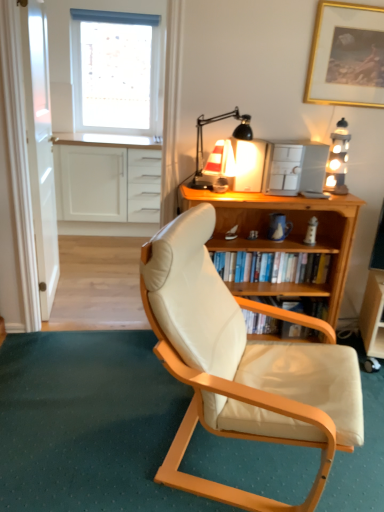
Question: Is white matte window at upper left aimed at transparent glass door at left?

Choices:
 (A) no
 (B) yes

Answer: (B)

Question: Is white matte window at upper left shorter than transparent glass door at left?

Choices:
 (A) no
 (B) yes

Answer: (B)

Question: Is the depth of white matte window at upper left less than that of transparent glass door at left?

Choices:
 (A) yes
 (B) no

Answer: (B)

Question: Is white matte window at upper left located outside transparent glass door at left?

Choices:
 (A) no
 (B) yes

Answer: (B)

Question: Is white matte window at upper left to the right of transparent glass door at left from the viewer's perspective?

Choices:
 (A) no
 (B) yes

Answer: (B)

Question: From the image's perspective, would you say white matte window at upper left is positioned over transparent glass door at left?

Choices:
 (A) yes
 (B) no

Answer: (A)

Question: From a real-world perspective, is matte cream leather chair at center positioned under white matte cabinet at upper left based on gravity?

Choices:
 (A) no
 (B) yes

Answer: (A)

Question: Is matte cream leather chair at center outside of white matte cabinet at upper left?

Choices:
 (A) yes
 (B) no

Answer: (A)

Question: Is matte cream leather chair at center oriented towards white matte cabinet at upper left?

Choices:
 (A) no
 (B) yes

Answer: (A)

Question: Considering the relative sizes of matte cream leather chair at center and white matte cabinet at upper left in the image provided, is matte cream leather chair at center bigger than white matte cabinet at upper left?

Choices:
 (A) yes
 (B) no

Answer: (A)

Question: Is matte cream leather chair at center surrounding white matte cabinet at upper left?

Choices:
 (A) no
 (B) yes

Answer: (A)

Question: Is matte cream leather chair at center shorter than white matte cabinet at upper left?

Choices:
 (A) yes
 (B) no

Answer: (B)

Question: Is wooden bookshelf at center not near wooden bookshelf at center?

Choices:
 (A) no
 (B) yes

Answer: (A)